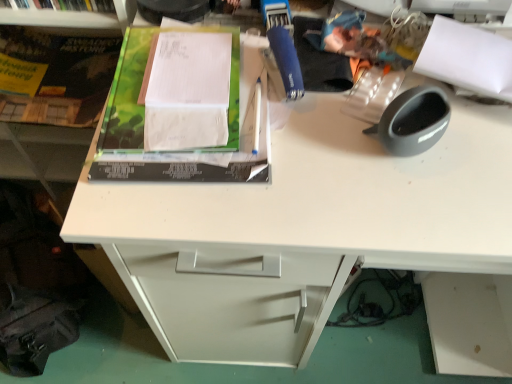
Where is `vacant space in white plastic shelf at upper left (from a real-world perspective)`? This screenshot has width=512, height=384. vacant space in white plastic shelf at upper left (from a real-world perspective) is located at coordinates (55, 6).